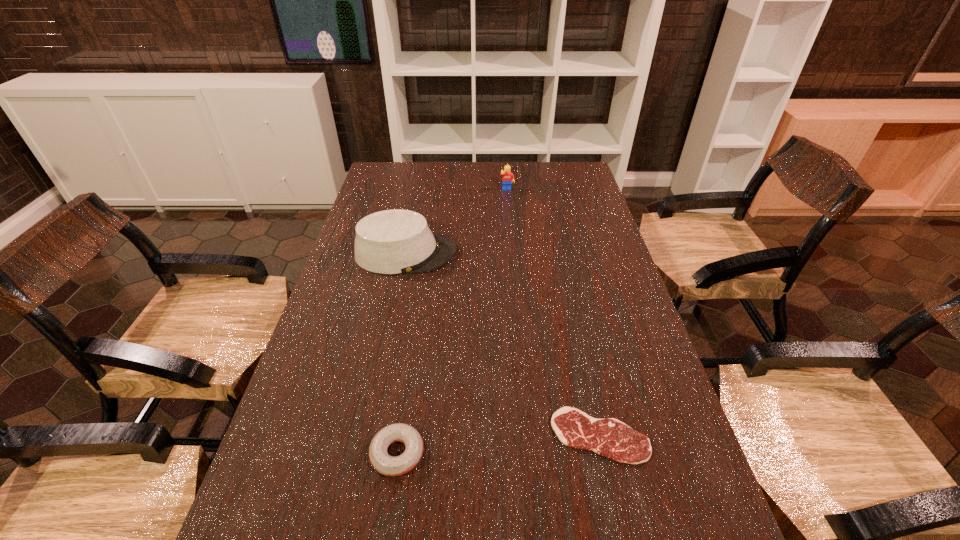
This screenshot has height=540, width=960. I want to click on object that is at the far edge, so click(508, 177).

Find the location of `object located in the left edge section of the desktop`. object located in the left edge section of the desktop is located at coordinates (397, 241).

Find the location of a particular element. This screenshot has height=540, width=960. object positioned at the right edge is located at coordinates (608, 437).

This screenshot has width=960, height=540. In order to click on vacant space at the far edge in this screenshot , I will do `click(443, 163)`.

In the image, there is a desktop. Where is `vacant space at the left edge`? The image size is (960, 540). vacant space at the left edge is located at coordinates (391, 197).

In order to click on vacant area at the right edge of the desktop in this screenshot , I will do `click(583, 253)`.

Where is `unoccupied area between the hat and the steak`? This screenshot has height=540, width=960. unoccupied area between the hat and the steak is located at coordinates (503, 345).

I want to click on vacant space in between the rightmost object and the doughnut, so click(x=498, y=445).

What are the coordinates of `free area in between the farthest object and the second shortest object` in the screenshot? It's located at (452, 322).

The image size is (960, 540). In order to click on free spot between the second shortest object and the Lego in this screenshot , I will do `click(452, 322)`.